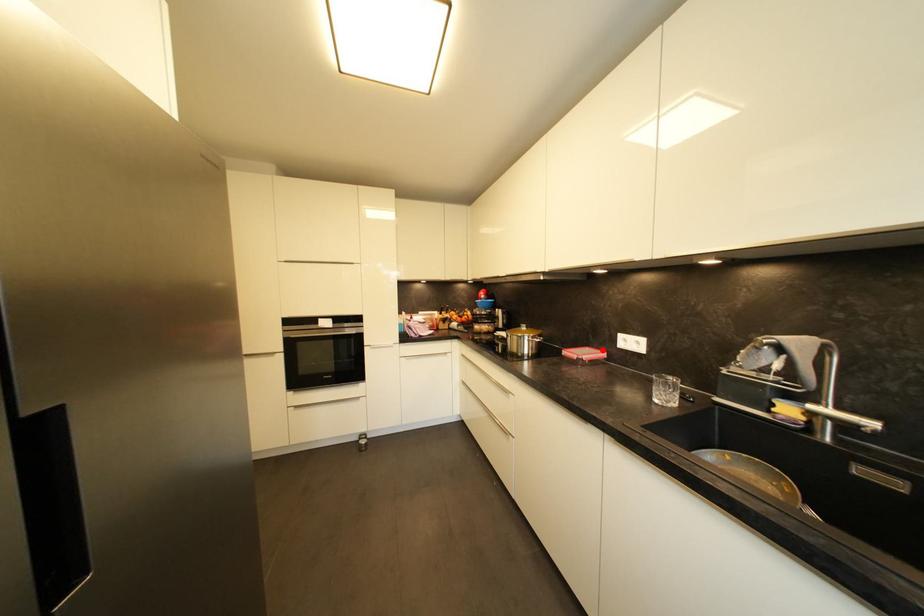
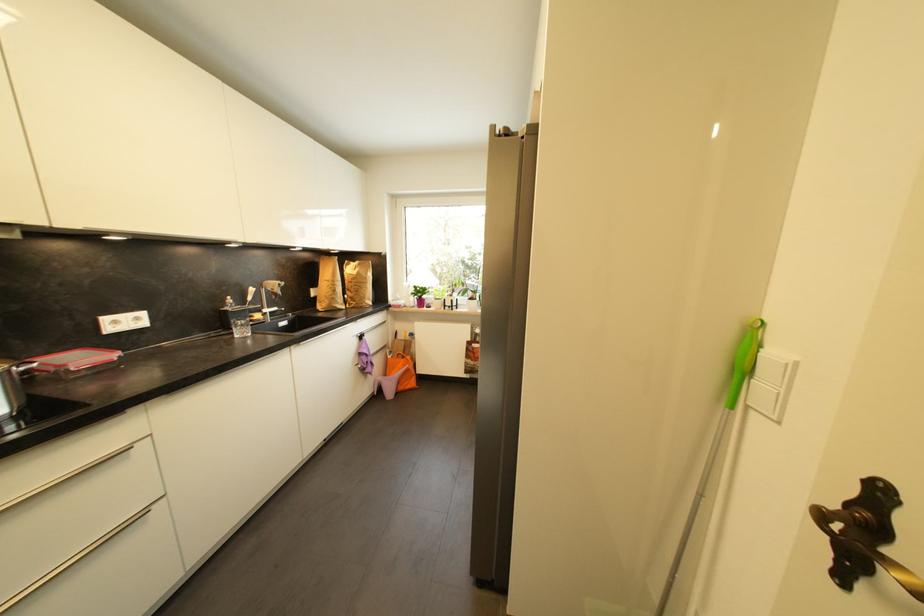
Where in the second image is the point corresponding to the highlighted location from the first image?

(54, 355)